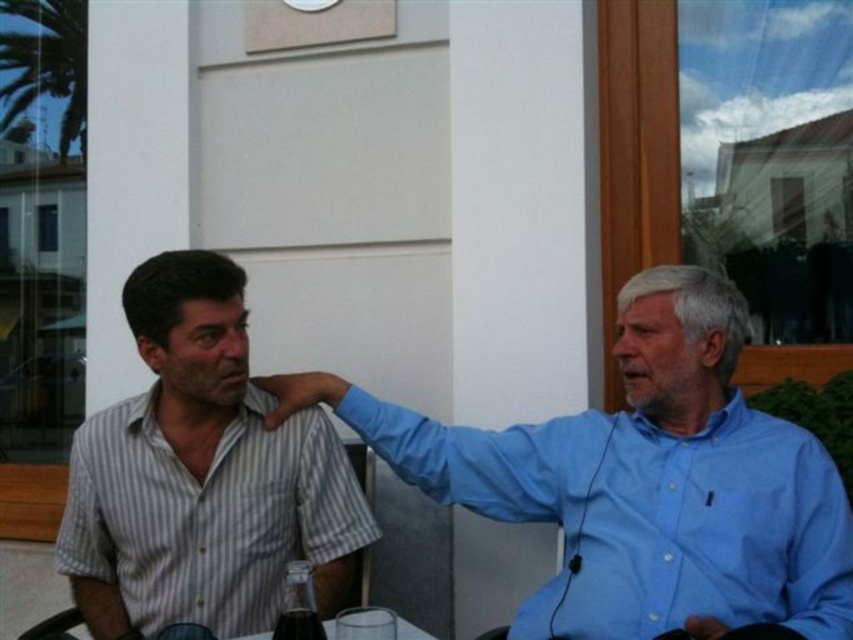
You are a delivery person who needs to place a translucent glass bottle at lower center at a specific coordinate. What are the coordinates where you should place it?

The translucent glass bottle at lower center should be placed at point (299, 605).

You are at the outdoor cafe and want to place a small potted plant between the two points marked as point (688, 570) and point (328, 637). Which point should the plant be closer to in order to be between them?

A: The plant should be closer to point (328, 637) because point (688, 570) is behind point (328, 637), meaning it is farther away from the observer. Placing the plant closer to the nearer point ensures it is between them.